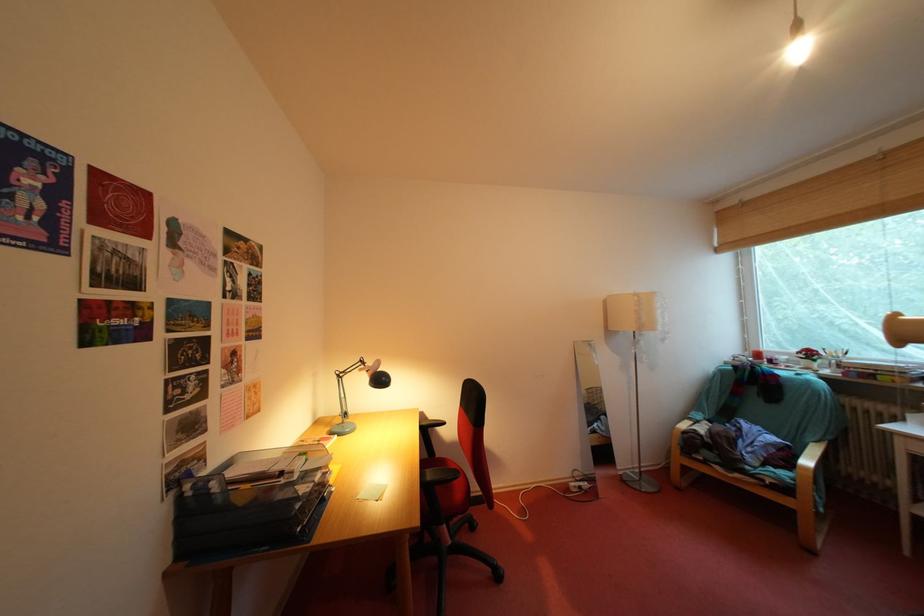
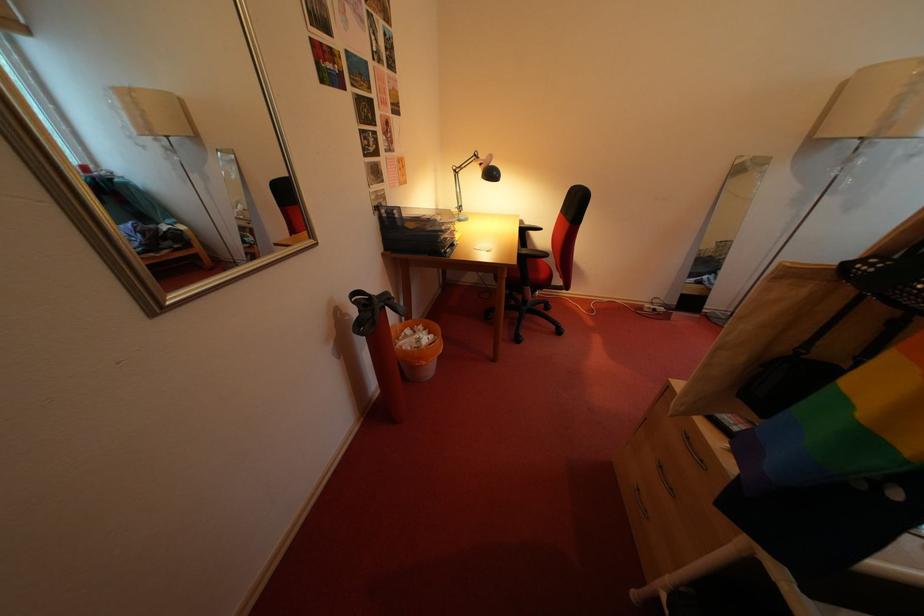
In the second image, find the point that corresponds to (378,384) in the first image.

(491, 177)